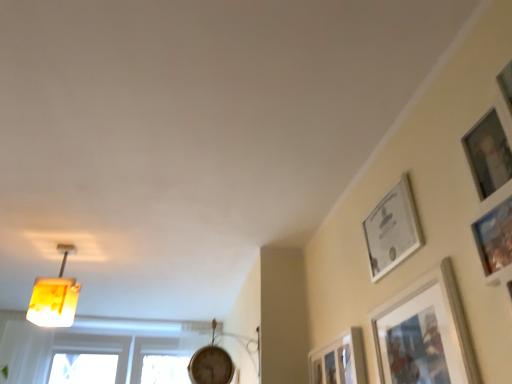
Question: Could matte silver picture frame at upper right, which is the first picture frame in right-to-left order, be considered to be inside white glossy picture frame at upper right, the 2th picture frame positioned from the left?

Choices:
 (A) yes
 (B) no

Answer: (B)

Question: Can you confirm if white glossy picture frame at upper right, which is the 2th picture frame from right to left, is wider than matte silver picture frame at upper right, which is the first picture frame in right-to-left order?

Choices:
 (A) no
 (B) yes

Answer: (A)

Question: Is white glossy picture frame at upper right, which is the 2th picture frame from right to left, taller than matte silver picture frame at upper right, the third picture frame viewed from the left?

Choices:
 (A) yes
 (B) no

Answer: (B)

Question: Considering the relative positions of white glossy picture frame at upper right, the 2th picture frame positioned from the left, and matte silver picture frame at upper right, the third picture frame viewed from the left, in the image provided, is white glossy picture frame at upper right, the 2th picture frame positioned from the left, to the left of matte silver picture frame at upper right, the third picture frame viewed from the left, from the viewer's perspective?

Choices:
 (A) yes
 (B) no

Answer: (A)

Question: From the image's perspective, is white glossy picture frame at upper right, the 2th picture frame positioned from the left, over matte silver picture frame at upper right, the third picture frame viewed from the left?

Choices:
 (A) no
 (B) yes

Answer: (B)

Question: From a real-world perspective, is white glossy picture frame at upper right, the 2th picture frame positioned from the left, on matte silver picture frame at upper right, which is the first picture frame in right-to-left order?

Choices:
 (A) no
 (B) yes

Answer: (B)

Question: From a real-world perspective, is matte silver picture frame at upper right, which is the first picture frame in right-to-left order, over white glossy picture frame at upper right, the 2th picture frame positioned from the left?

Choices:
 (A) no
 (B) yes

Answer: (A)

Question: Considering the relative sizes of matte silver picture frame at upper right, the third picture frame viewed from the left, and white glossy picture frame at upper right, which is the 2th picture frame from right to left, in the image provided, is matte silver picture frame at upper right, the third picture frame viewed from the left, smaller than white glossy picture frame at upper right, which is the 2th picture frame from right to left,?

Choices:
 (A) yes
 (B) no

Answer: (B)

Question: Is matte silver picture frame at upper right, which is the first picture frame in right-to-left order, closer to camera compared to white glossy picture frame at upper right, the 2th picture frame positioned from the left?

Choices:
 (A) no
 (B) yes

Answer: (B)

Question: Is matte silver picture frame at upper right, the third picture frame viewed from the left, further to camera compared to white glossy picture frame at upper right, the 2th picture frame positioned from the left?

Choices:
 (A) yes
 (B) no

Answer: (B)

Question: Can you see matte silver picture frame at upper right, which is the first picture frame in right-to-left order, touching white glossy picture frame at upper right, which is the 2th picture frame from right to left?

Choices:
 (A) no
 (B) yes

Answer: (A)

Question: From the image's perspective, is matte silver picture frame at upper right, the third picture frame viewed from the left, located above white glossy picture frame at upper right, which is the 2th picture frame from right to left?

Choices:
 (A) no
 (B) yes

Answer: (A)

Question: Considering the relative positions of matte silver picture frame at upper right, which is the first picture frame in right-to-left order, and yellow translucent lampshade at upper left in the image provided, is matte silver picture frame at upper right, which is the first picture frame in right-to-left order, to the left of yellow translucent lampshade at upper left from the viewer's perspective?

Choices:
 (A) no
 (B) yes

Answer: (A)